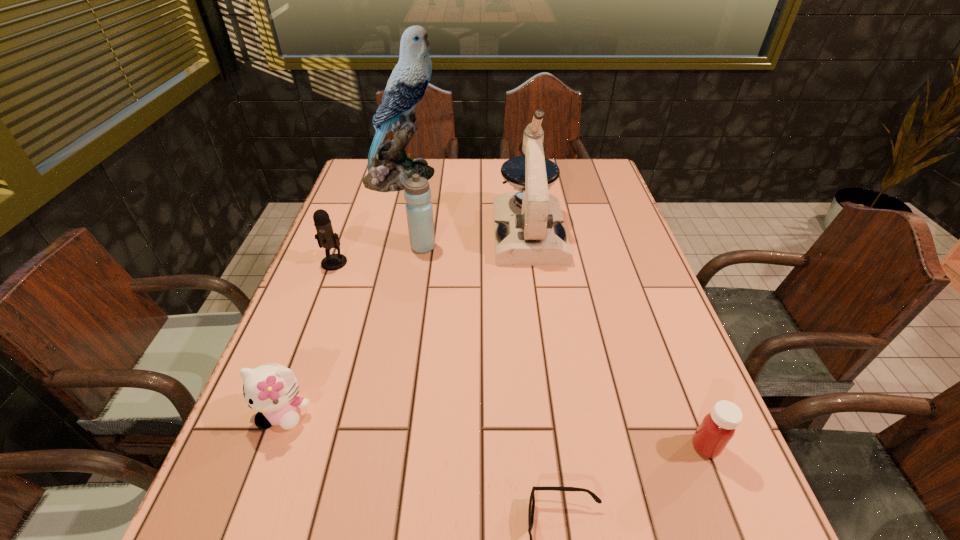
Locate an element on the screen. The width and height of the screenshot is (960, 540). vacant area located 0.300m on the back of the microphone is located at coordinates (360, 195).

This screenshot has height=540, width=960. Identify the location of vacant space located 0.060m on the front-facing side of the kitten. (264, 467).

Find the location of a particular element. Image resolution: width=960 pixels, height=540 pixels. vacant space located on the left of the rightmost object is located at coordinates (545, 447).

Identify the location of object present at the far edge. (389, 166).

You are a GUI agent. You are given a task and a screenshot of the screen. Output one action in this format:
    pyautogui.click(x=<x>, y=<y>)
    Task: Click on the parakeet that is at the left edge
    This screenshot has height=540, width=960.
    Given the screenshot: What is the action you would take?
    pyautogui.click(x=389, y=166)

Identify the location of microphone that is at the left edge. The width and height of the screenshot is (960, 540). (326, 238).

You are a GUI agent. You are given a task and a screenshot of the screen. Output one action in this format:
    pyautogui.click(x=<x>, y=<y>)
    Task: Click on the kitten present at the left edge
    
    Given the screenshot: What is the action you would take?
    pyautogui.click(x=271, y=389)

This screenshot has height=540, width=960. What are the coordinates of `object present at the right edge` in the screenshot? It's located at point(717,428).

Find the location of a particular element. The width and height of the screenshot is (960, 540). object located in the far left corner section of the desktop is located at coordinates (389, 166).

Identify the location of vacant region at the far edge of the desktop. Image resolution: width=960 pixels, height=540 pixels. (457, 174).